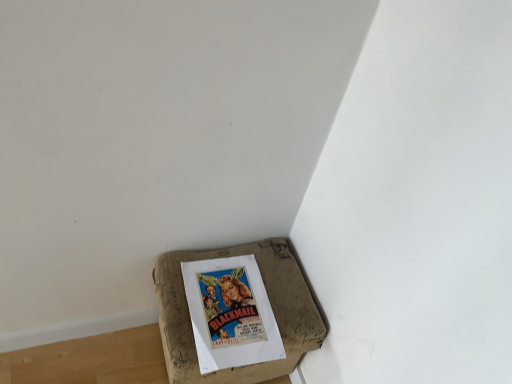
Locate an element on the screen. The image size is (512, 384). brown cardboard box at lower left is located at coordinates (271, 306).

The width and height of the screenshot is (512, 384). What do you see at coordinates (271, 306) in the screenshot?
I see `brown cardboard box at lower left` at bounding box center [271, 306].

Measure the distance between vintage paper poster at bottom corner and camera.

The distance of vintage paper poster at bottom corner from camera is 38.15 inches.

The width and height of the screenshot is (512, 384). I want to click on vintage paper poster at bottom corner, so click(230, 313).

What do you see at coordinates (230, 313) in the screenshot? I see `vintage paper poster at bottom corner` at bounding box center [230, 313].

At what (x,y) coordinates should I click in order to perform the action: click on brown cardboard box at lower left. Please return your answer as a coordinate pair (x, y). Looking at the image, I should click on (271, 306).

Which object is positioned more to the right, vintage paper poster at bottom corner or brown cardboard box at lower left?

From the viewer's perspective, vintage paper poster at bottom corner appears more on the right side.

Is the depth of vintage paper poster at bottom corner greater than that of brown cardboard box at lower left?

Yes, it is.

Considering the points (231, 283) and (315, 311), which point is in front, point (231, 283) or point (315, 311)?

Point (315, 311)

From the image's perspective, would you say vintage paper poster at bottom corner is shown under brown cardboard box at lower left?

Actually, vintage paper poster at bottom corner appears above brown cardboard box at lower left in the image.

From a real-world perspective, is vintage paper poster at bottom corner above or below brown cardboard box at lower left?

vintage paper poster at bottom corner is above brown cardboard box at lower left.

Considering the sizes of objects vintage paper poster at bottom corner and brown cardboard box at lower left in the image provided, who is wider, vintage paper poster at bottom corner or brown cardboard box at lower left?

With larger width is brown cardboard box at lower left.

Is vintage paper poster at bottom corner shorter than brown cardboard box at lower left?

Yes.

Who is bigger, vintage paper poster at bottom corner or brown cardboard box at lower left?

With larger size is brown cardboard box at lower left.

Based on the photo, is vintage paper poster at bottom corner located outside brown cardboard box at lower left?

No, vintage paper poster at bottom corner is not entirely external to brown cardboard box at lower left.

Is vintage paper poster at bottom corner next to brown cardboard box at lower left and touching it?

Yes, vintage paper poster at bottom corner is right next to brown cardboard box at lower left and making contact.

Is vintage paper poster at bottom corner facing away from brown cardboard box at lower left?

Correct, vintage paper poster at bottom corner is looking away from brown cardboard box at lower left.

From the picture: Can you tell me how much vintage paper poster at bottom corner and brown cardboard box at lower left differ in facing direction?

The angle between the facing direction of vintage paper poster at bottom corner and the facing direction of brown cardboard box at lower left is 2.48 degrees.

Where is `comic book that appears above the brown cardboard box at lower left (from a real-world perspective)`? comic book that appears above the brown cardboard box at lower left (from a real-world perspective) is located at coordinates (230, 313).

Is brown cardboard box at lower left to the left of vintage paper poster at bottom corner from the viewer's perspective?

Correct, you'll find brown cardboard box at lower left to the left of vintage paper poster at bottom corner.

Which object is further away from the camera taking this photo, brown cardboard box at lower left or vintage paper poster at bottom corner?

vintage paper poster at bottom corner.

Is point (306, 295) closer to viewer compared to point (256, 303)?

No, (306, 295) is further to viewer.

From the image's perspective, between brown cardboard box at lower left and vintage paper poster at bottom corner, which one is located above?

vintage paper poster at bottom corner is shown above in the image.

From a real-world perspective, relative to vintage paper poster at bottom corner, is brown cardboard box at lower left vertically above or below?

Clearly, from a real-world perspective, brown cardboard box at lower left is below vintage paper poster at bottom corner.

Can you confirm if brown cardboard box at lower left is thinner than vintage paper poster at bottom corner?

Incorrect, the width of brown cardboard box at lower left is not less than that of vintage paper poster at bottom corner.

From their relative heights in the image, would you say brown cardboard box at lower left is taller or shorter than vintage paper poster at bottom corner?

brown cardboard box at lower left is taller than vintage paper poster at bottom corner.

Considering the sizes of brown cardboard box at lower left and vintage paper poster at bottom corner in the image, is brown cardboard box at lower left bigger or smaller than vintage paper poster at bottom corner?

brown cardboard box at lower left is bigger than vintage paper poster at bottom corner.

Looking at this image, which is correct: brown cardboard box at lower left is inside vintage paper poster at bottom corner, or outside of it?

brown cardboard box at lower left is not inside vintage paper poster at bottom corner, it's outside.

Is the surface of brown cardboard box at lower left in direct contact with vintage paper poster at bottom corner?

Yes, the surface of brown cardboard box at lower left is in contact with vintage paper poster at bottom corner.

Is brown cardboard box at lower left looking in the opposite direction of vintage paper poster at bottom corner?

brown cardboard box at lower left is not turned away from vintage paper poster at bottom corner.

What's the angular difference between brown cardboard box at lower left and vintage paper poster at bottom corner's facing directions?

The facing directions of brown cardboard box at lower left and vintage paper poster at bottom corner are 2.48 degrees apart.

Image resolution: width=512 pixels, height=384 pixels. I want to click on furniture below the vintage paper poster at bottom corner (from a real-world perspective), so click(271, 306).

This screenshot has height=384, width=512. Find the location of `furniture directly beneath the vintage paper poster at bottom corner (from a real-world perspective)`. furniture directly beneath the vintage paper poster at bottom corner (from a real-world perspective) is located at coordinates (271, 306).

The width and height of the screenshot is (512, 384). Find the location of `furniture in front of the vintage paper poster at bottom corner`. furniture in front of the vintage paper poster at bottom corner is located at coordinates (271, 306).